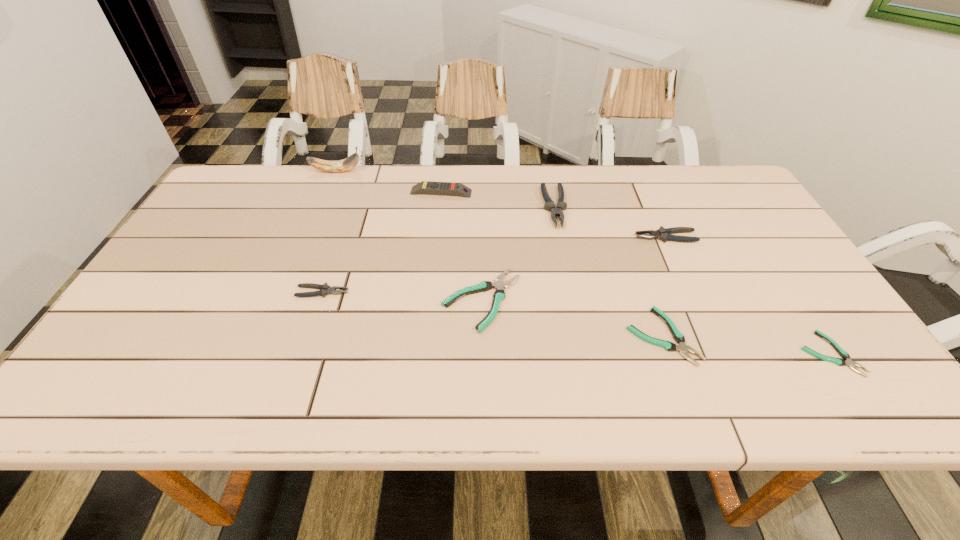
Where is `object that is at the near right corner`? The height and width of the screenshot is (540, 960). object that is at the near right corner is located at coordinates (840, 362).

Image resolution: width=960 pixels, height=540 pixels. I want to click on vacant point at the far edge, so click(x=447, y=164).

Find the location of a particular element. The image size is (960, 540). blank space at the near edge of the desktop is located at coordinates (557, 389).

Where is `free space at the left edge of the desktop`? Image resolution: width=960 pixels, height=540 pixels. free space at the left edge of the desktop is located at coordinates (196, 273).

Image resolution: width=960 pixels, height=540 pixels. What are the coordinates of `free space at the far left corner` in the screenshot? It's located at (268, 181).

This screenshot has width=960, height=540. In order to click on vacant area between the second biggest teal pliers and the banana in this screenshot , I will do `click(499, 254)`.

Where is `unoccupied position between the second smallest teal pliers and the rightmost teal pliers`? unoccupied position between the second smallest teal pliers and the rightmost teal pliers is located at coordinates (746, 345).

Find the location of `vacant area that lies between the farthest object and the leftmost gray pliers`. vacant area that lies between the farthest object and the leftmost gray pliers is located at coordinates (329, 232).

At what (x,y) coordinates should I click in order to perform the action: click on free space between the leftmost teal pliers and the remote control. Please return your answer as a coordinate pair (x, y). This screenshot has height=540, width=960. Looking at the image, I should click on (462, 246).

Where is `vacant area between the tallest pliers and the remote control`? vacant area between the tallest pliers and the remote control is located at coordinates (498, 200).